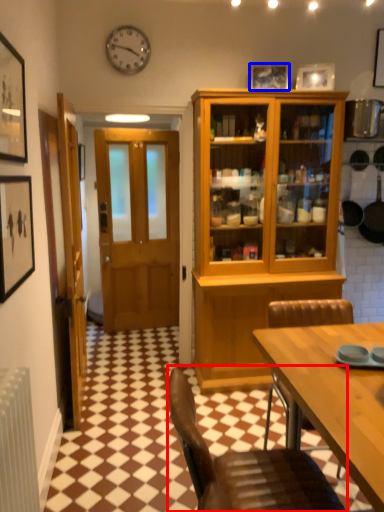
Question: Which point is further to the camera, chair (highlighted by a red box) or picture frame (highlighted by a blue box)?

Choices:
 (A) chair
 (B) picture frame

Answer: (B)